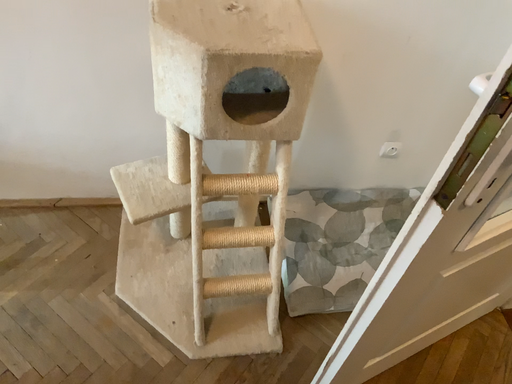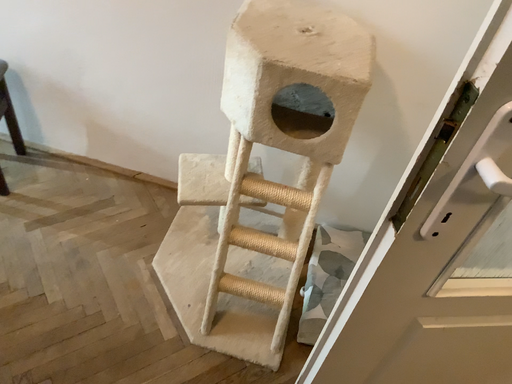
Question: Which way did the camera rotate in the video?

Choices:
 (A) rotated left
 (B) rotated right

Answer: (A)